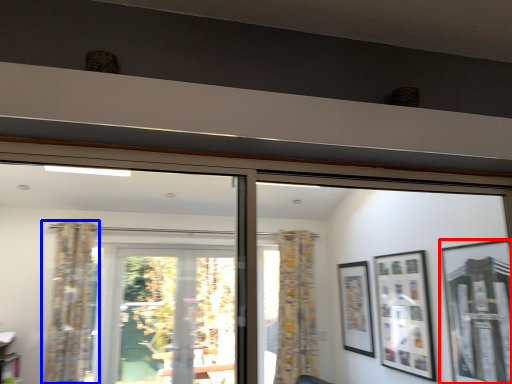
Question: Which point is further to the camera, picture frame (highlighted by a red box) or curtain (highlighted by a blue box)?

Choices:
 (A) picture frame
 (B) curtain

Answer: (B)